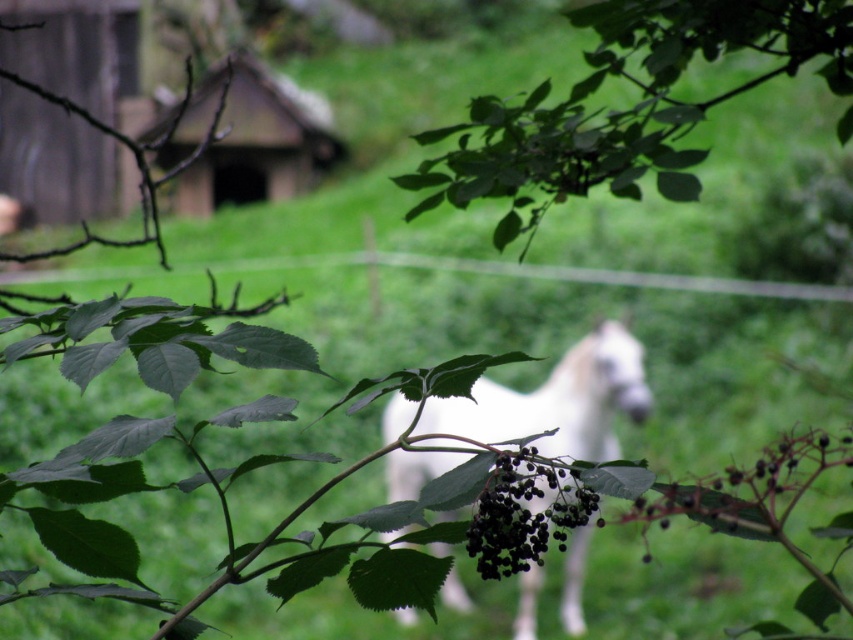
Question: Is green leafy branch at upper center positioned behind wooden hut at upper center?

Choices:
 (A) yes
 (B) no

Answer: (B)

Question: Which object is closer to the camera taking this photo?

Choices:
 (A) wooden hut at upper center
 (B) black matte berries at center

Answer: (B)

Question: Is green leafy branch at upper center in front of wooden hut at upper center?

Choices:
 (A) no
 (B) yes

Answer: (B)

Question: Which is nearer to the black matte berries at center?

Choices:
 (A) green leafy branch at upper center
 (B) wooden hut at upper center

Answer: (A)

Question: Which point is closer to the camera taking this photo?

Choices:
 (A) (798, 24)
 (B) (200, 134)

Answer: (A)

Question: Does white glossy horse at center have a larger size compared to black matte berries at center?

Choices:
 (A) yes
 (B) no

Answer: (A)